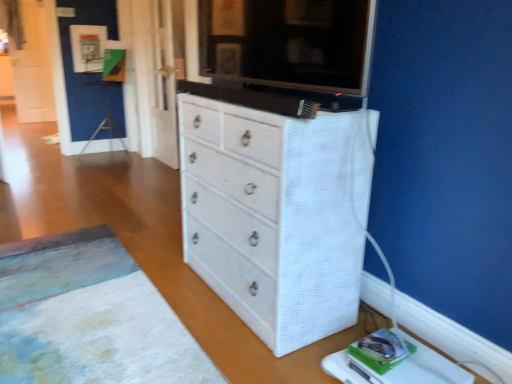
Question: From the image's perspective, is white textured changing table at lower right above or below white textured cabinet at upper center?

Choices:
 (A) above
 (B) below

Answer: (B)

Question: Considering their positions, is white textured changing table at lower right located in front of or behind white textured cabinet at upper center?

Choices:
 (A) behind
 (B) front

Answer: (B)

Question: Which object is positioned farthest from the white textured changing table at lower right?

Choices:
 (A) white textured cabinet at upper center
 (B) white textured chest of drawers at center
 (C) white textured rug at lower left

Answer: (A)

Question: Estimate the real-world distances between objects in this image. Which object is farther from the white textured cabinet at upper center?

Choices:
 (A) white textured rug at lower left
 (B) white textured chest of drawers at center
 (C) white textured changing table at lower right

Answer: (A)